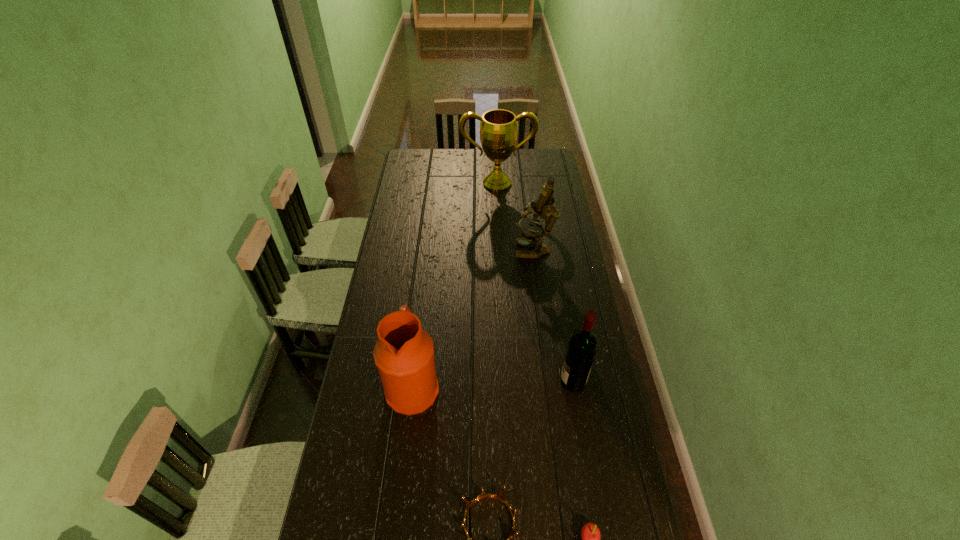
Find the location of a particular element. unoccupied position between the farthest object and the water jug is located at coordinates (455, 285).

At what (x,y) coordinates should I click in order to perform the action: click on object that is the fourth closest to the leftmost object. Please return your answer as a coordinate pair (x, y). The height and width of the screenshot is (540, 960). Looking at the image, I should click on (544, 208).

Image resolution: width=960 pixels, height=540 pixels. I want to click on object that is the second closest to the crown, so click(x=404, y=353).

Locate an element on the screen. The image size is (960, 540). free point that satisfies the following two spatial constraints: 1. on the front side of the fifth nearest object; 2. from the spout of the leftmost object is located at coordinates (551, 387).

Identify the location of free region that satisfies the following two spatial constraints: 1. on the front-facing side of the farthest object; 2. from the spout of the water jug. The height and width of the screenshot is (540, 960). (507, 387).